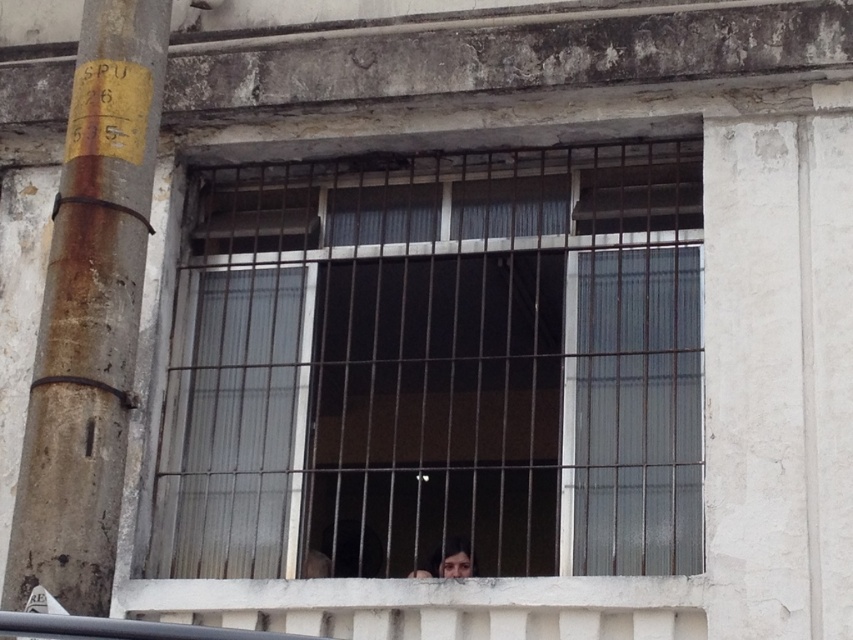
Question: Does clear glass window at center lie behind rusty metal pole at left?

Choices:
 (A) yes
 (B) no

Answer: (A)

Question: Is rusty metal pole at left below smooth skin face at center?

Choices:
 (A) yes
 (B) no

Answer: (B)

Question: Among these objects, which one is nearest to the camera?

Choices:
 (A) smooth skin face at center
 (B) clear glass window at center
 (C) rusty metal pole at left

Answer: (C)

Question: Which object appears farthest from the camera in this image?

Choices:
 (A) rusty metal pole at left
 (B) clear glass window at center

Answer: (B)

Question: Which point is farther to the camera?

Choices:
 (A) (506, 179)
 (B) (158, 113)

Answer: (A)

Question: Is clear glass window at center above smooth skin face at center?

Choices:
 (A) no
 (B) yes

Answer: (B)